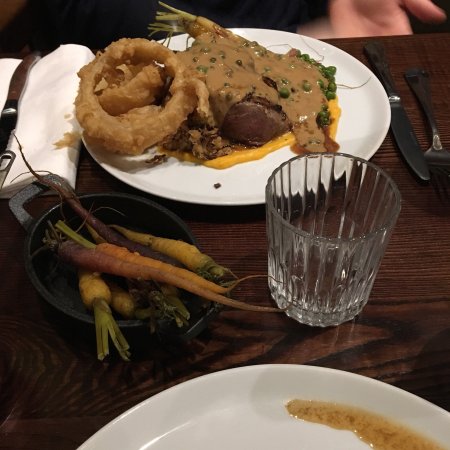
Find the location of a particular element. napkin is located at coordinates (36, 140).